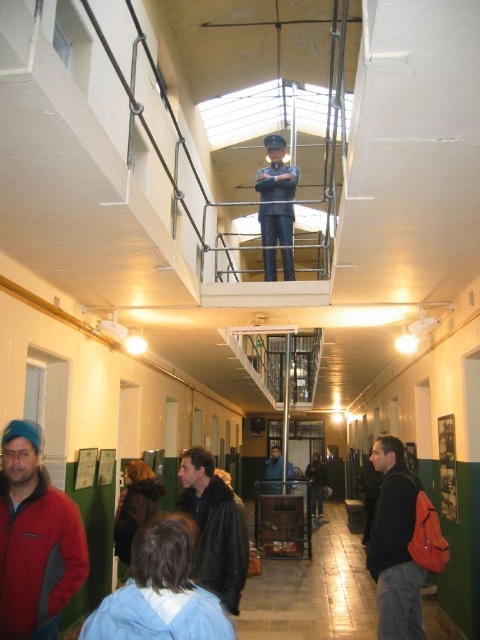
Can you confirm if brushed red jacket at lower left is wider than uniformed officer at upper center?

No, brushed red jacket at lower left is not wider than uniformed officer at upper center.

How distant is brushed red jacket at lower left from uniformed officer at upper center?

brushed red jacket at lower left and uniformed officer at upper center are 4.59 meters apart from each other.

Who is more forward, (x=1, y=604) or (x=284, y=278)?

Point (x=1, y=604)

Locate an element on the screen. The height and width of the screenshot is (640, 480). brushed red jacket at lower left is located at coordinates (35, 540).

Can you confirm if black leather jacket at lower center is positioned below dark blue uniform at center?

Actually, black leather jacket at lower center is above dark blue uniform at center.

Who is lower down, black leather jacket at lower center or dark blue uniform at center?

dark blue uniform at center is below.

Where is `black leather jacket at lower center`? This screenshot has height=640, width=480. black leather jacket at lower center is located at coordinates (214, 528).

Is matte black jacket at lower right to the right of dark blue uniform at center from the viewer's perspective?

In fact, matte black jacket at lower right is to the left of dark blue uniform at center.

Can you confirm if matte black jacket at lower right is shorter than dark blue uniform at center?

Incorrect, matte black jacket at lower right's height does not fall short of dark blue uniform at center's.

Who is more distant from viewer, (374, 442) or (314, 465)?

Positioned behind is point (314, 465).

This screenshot has width=480, height=640. Find the location of `matte black jacket at lower right`. matte black jacket at lower right is located at coordinates (395, 545).